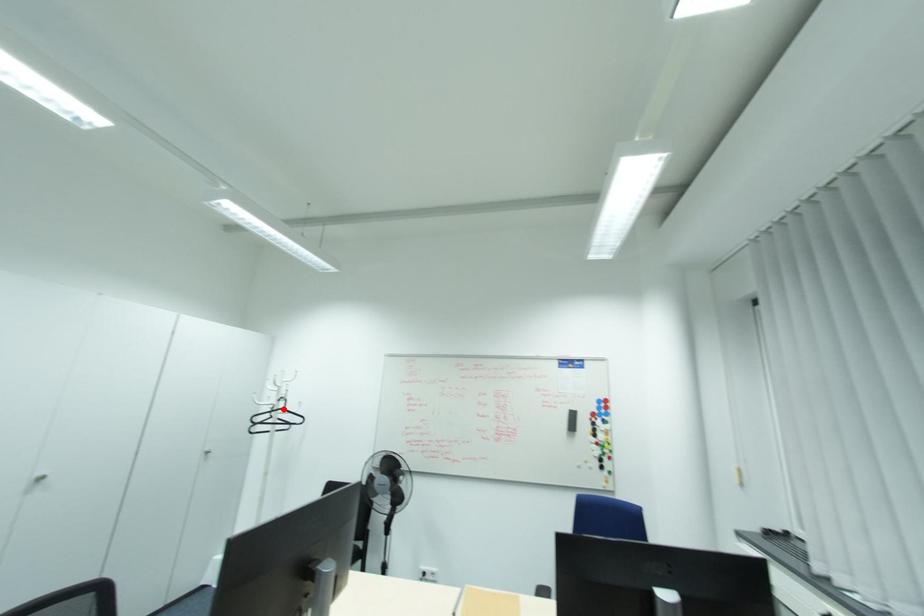
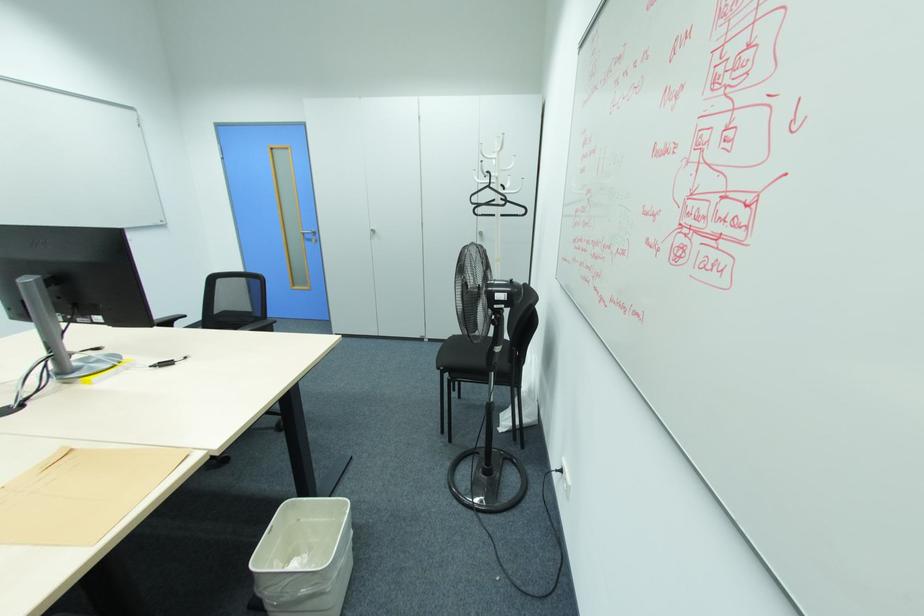
Question: I am providing you with two images of the same scene from different viewpoints. A red point is shown in image1. For the corresponding object point in image2, is it positioned nearer or farther from the camera?

Choices:
 (A) Nearer
 (B) Farther

Answer: (A)